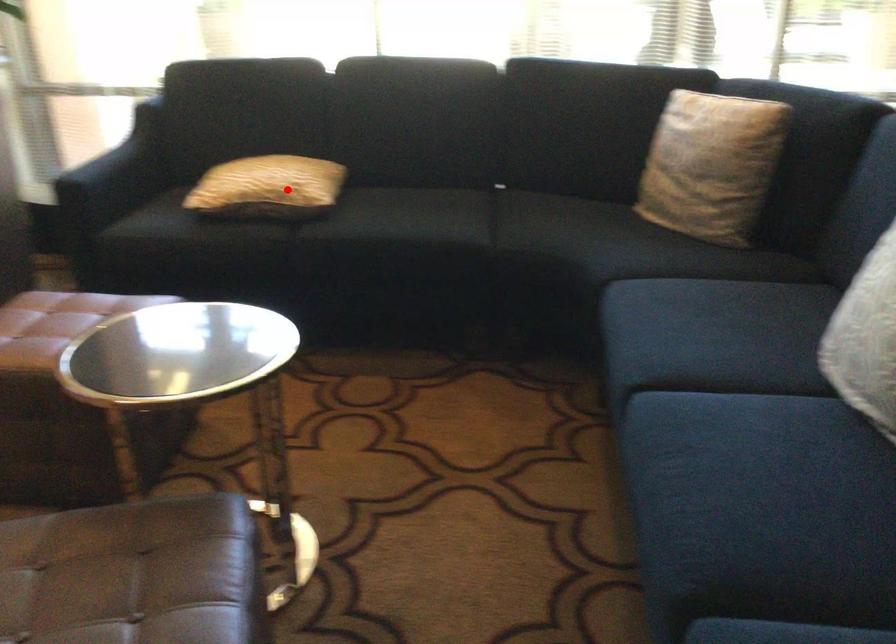
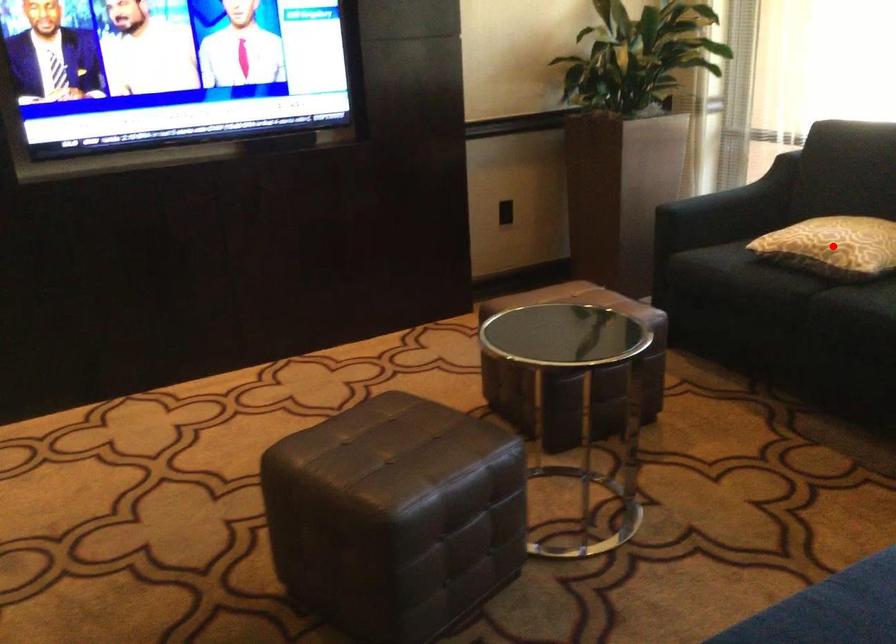
I am providing you with two images of the same scene from different viewpoints. A red point is marked on the first image and another point is marked on the second image. Is the marked point in image1 the same physical position as the marked point in image2?

Yes